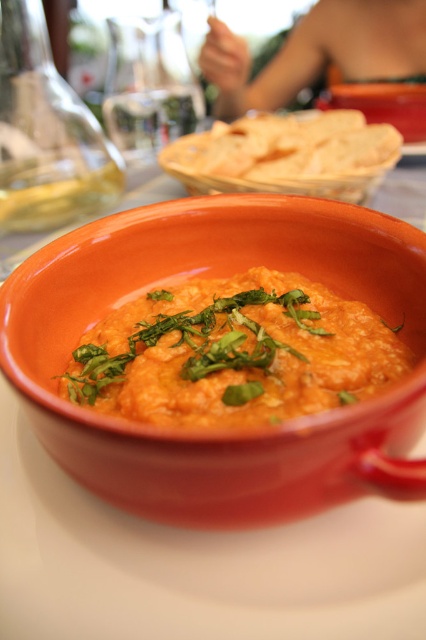
In the scene shown: You are a photographer setting up a shot of the matte ceramic bowl at center. The camera is positioned to capture the bowl clearly. If the bowl is currently 8.17 inches away from the camera, is it within the recommended 8 inch minimum distance for sharp focus? Please answer with yes or no.

The matte ceramic bowl at center is 8.17 inches away from camera, so yes, it is within the recommended 8 inch minimum distance for sharp focus.

You are a guest at a dinner table and see the point marked at coordinates (210, 435). What object is located at that point?

The point at coordinates (210, 435) corresponds to the matte ceramic bowl at center.

You have a small spoon that can only hold up to the size of the matte orange dip at center. Can you use this spoon to scoop the entire matte ceramic bowl at center?

The matte ceramic bowl at center is bigger than the matte orange dip at center, so the spoon cannot scoop the entire matte ceramic bowl at center because it is larger than the dip.